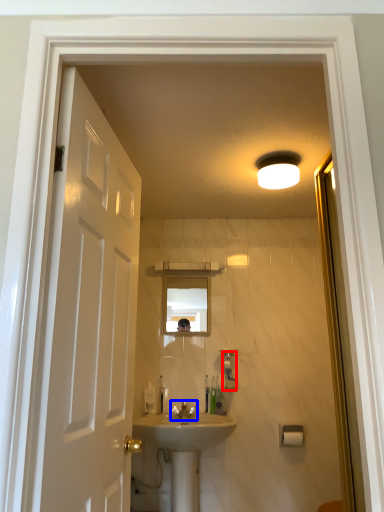
Question: Which of the following is the farthest to the observer, soap dispenser (highlighted by a red box) or tap (highlighted by a blue box)?

Choices:
 (A) soap dispenser
 (B) tap

Answer: (A)